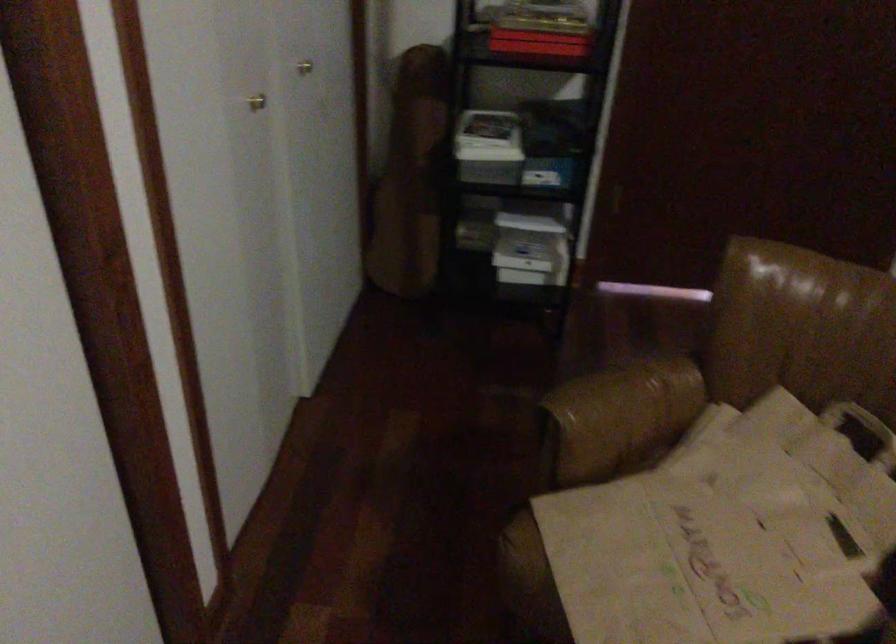
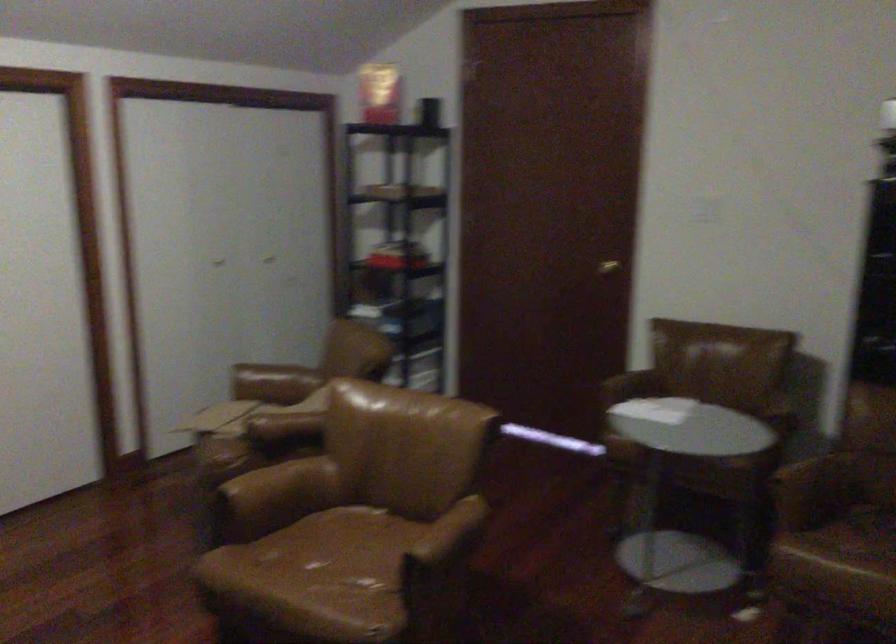
Find the pixel in the second image that matches pixel 588 413 in the first image.

(273, 383)